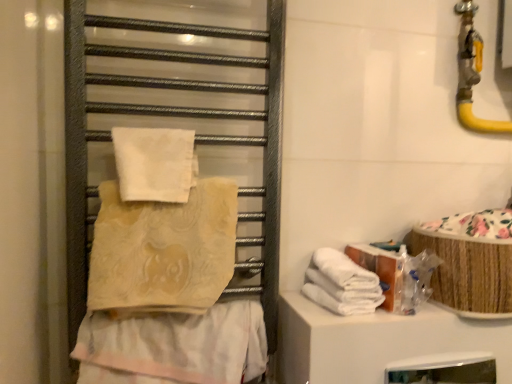
Where is `white soft towels at lower right, marked as the second towel in a bottom-to-top arrangement`? The height and width of the screenshot is (384, 512). white soft towels at lower right, marked as the second towel in a bottom-to-top arrangement is located at coordinates (341, 284).

The image size is (512, 384). What do you see at coordinates (178, 122) in the screenshot?
I see `metallic towel rack at left` at bounding box center [178, 122].

Identify the location of white soft towels at lower right, marked as the second towel in a bottom-to-top arrangement. The image size is (512, 384). (341, 284).

What's the angular difference between white soft towels at lower right, marked as the second towel in a bottom-to-top arrangement, and woven bamboo basket at right's facing directions?

They differ by 1.29 degrees in their facing directions.

Is woven bamboo basket at right surrounded by white soft towels at lower right, marked as the second towel in a bottom-to-top arrangement?

No, white soft towels at lower right, marked as the second towel in a bottom-to-top arrangement, does not contain woven bamboo basket at right.

Is white soft towels at lower right, marked as the second towel in a bottom-to-top arrangement, far from woven bamboo basket at right?

white soft towels at lower right, marked as the second towel in a bottom-to-top arrangement, is actually quite close to woven bamboo basket at right.

In terms of height, does white soft towels at lower right, marked as the second towel in a bottom-to-top arrangement, look taller or shorter compared to woven bamboo basket at right?

Considering their sizes, white soft towels at lower right, marked as the second towel in a bottom-to-top arrangement, has less height than woven bamboo basket at right.

Is beige textured towel at center, positioned as the second towel in top-to-bottom order, spatially inside beige textured towel at center, the fourth towel positioned from the top, or outside of it?

beige textured towel at center, positioned as the second towel in top-to-bottom order, exists outside the volume of beige textured towel at center, the fourth towel positioned from the top.

Considering the sizes of objects beige textured towel at center, positioned as the second towel in top-to-bottom order, and beige textured towel at center, the fourth towel positioned from the top, in the image provided, who is taller, beige textured towel at center, positioned as the second towel in top-to-bottom order, or beige textured towel at center, the fourth towel positioned from the top,?

beige textured towel at center, positioned as the second towel in top-to-bottom order.

Can you confirm if beige textured towel at center, positioned as the second towel in top-to-bottom order, is bigger than beige textured towel at center, the fourth towel positioned from the top?

Yes, beige textured towel at center, positioned as the second towel in top-to-bottom order, is bigger than beige textured towel at center, the fourth towel positioned from the top.

You are a GUI agent. You are given a task and a screenshot of the screen. Output one action in this format:
    pyautogui.click(x=<x>, y=<y>)
    Task: Click on the 1st towel behind the beige textured towel at center, positioned as the second towel in top-to-bottom order, counting from the anchor's position
    
    Given the screenshot: What is the action you would take?
    pyautogui.click(x=175, y=347)

Is metallic towel rack at left directly adjacent to beige textured towel at center, the fourth towel positioned from the top?

No, metallic towel rack at left is not beside beige textured towel at center, the fourth towel positioned from the top.

Do you think metallic towel rack at left is within beige textured towel at center, arranged as the 1th towel when ordered from the bottom, or outside of it?

The correct answer is: outside.

Is metallic towel rack at left closer to the viewer compared to beige textured towel at center, the fourth towel positioned from the top?

Yes, the depth of metallic towel rack at left is less than that of beige textured towel at center, the fourth towel positioned from the top.

From the image's perspective, is beige textured towel at center, the fourth towel positioned from the top, beneath white soft towels at lower right, acting as the third towel starting from the top?

Correct, beige textured towel at center, the fourth towel positioned from the top, appears lower than white soft towels at lower right, acting as the third towel starting from the top, in the image.

Which object is more forward, beige textured towel at center, the fourth towel positioned from the top, or white soft towels at lower right, marked as the second towel in a bottom-to-top arrangement?

beige textured towel at center, the fourth towel positioned from the top, is closer to the camera.

Based on the photo, is beige textured towel at center, the fourth towel positioned from the top, thinner than white soft towels at lower right, acting as the third towel starting from the top?

Yes.

Is beige textured towel at center, the fourth towel positioned from the top, directly adjacent to white soft towels at lower right, marked as the second towel in a bottom-to-top arrangement?

No, beige textured towel at center, the fourth towel positioned from the top, is not making contact with white soft towels at lower right, marked as the second towel in a bottom-to-top arrangement.

In order to click on towel in front of the beige textured towel at center, arranged as the 1th towel when ordered from the bottom in this screenshot , I will do `click(163, 251)`.

Based on the photo, is beige textured towel at center, arranged as the 1th towel when ordered from the bottom, not inside beige textured towel at center, the third towel when ordered from bottom to top?

beige textured towel at center, arranged as the 1th towel when ordered from the bottom, is positioned outside beige textured towel at center, the third towel when ordered from bottom to top.

Considering the sizes of beige textured towel at center, arranged as the 1th towel when ordered from the bottom, and beige textured towel at center, positioned as the second towel in top-to-bottom order, in the image, is beige textured towel at center, arranged as the 1th towel when ordered from the bottom, bigger or smaller than beige textured towel at center, positioned as the second towel in top-to-bottom order,?

In the image, beige textured towel at center, arranged as the 1th towel when ordered from the bottom, appears to be smaller than beige textured towel at center, positioned as the second towel in top-to-bottom order.

Would you consider beige textured towel at center, the fourth towel positioned from the top, to be distant from beige textured towel at center, positioned as the second towel in top-to-bottom order?

beige textured towel at center, the fourth towel positioned from the top, is actually quite close to beige textured towel at center, positioned as the second towel in top-to-bottom order.

Does beige textured towel at center, the fourth towel positioned from the top, contain woven bamboo basket at right?

No, beige textured towel at center, the fourth towel positioned from the top, does not contain woven bamboo basket at right.

Find the location of a particular element. The image size is (512, 384). material that is above the beige textured towel at center, arranged as the 1th towel when ordered from the bottom (from the image's perspective) is located at coordinates (469, 259).

Which point is more distant from viewer, (x=232, y=361) or (x=437, y=276)?

The point (x=437, y=276) is farther.

From the picture: Considering the sizes of white soft towels at lower right, acting as the third towel starting from the top, and beige textured towel at center, arranged as the 1th towel when ordered from the bottom, in the image, is white soft towels at lower right, acting as the third towel starting from the top, wider or thinner than beige textured towel at center, arranged as the 1th towel when ordered from the bottom,?

Clearly, white soft towels at lower right, acting as the third towel starting from the top, has more width compared to beige textured towel at center, arranged as the 1th towel when ordered from the bottom.

Considering the sizes of objects white soft towels at lower right, marked as the second towel in a bottom-to-top arrangement, and beige textured towel at center, the fourth towel positioned from the top, in the image provided, who is shorter, white soft towels at lower right, marked as the second towel in a bottom-to-top arrangement, or beige textured towel at center, the fourth towel positioned from the top,?

white soft towels at lower right, marked as the second towel in a bottom-to-top arrangement.

Is white soft towels at lower right, marked as the second towel in a bottom-to-top arrangement, far away from beige textured towel at center, arranged as the 1th towel when ordered from the bottom?

No.

Is beige textured towel at center, arranged as the 1th towel when ordered from the bottom, located within white soft towels at lower right, acting as the third towel starting from the top?

Actually, beige textured towel at center, arranged as the 1th towel when ordered from the bottom, is outside white soft towels at lower right, acting as the third towel starting from the top.

What are the coordinates of `material behind the white soft towels at lower right, marked as the second towel in a bottom-to-top arrangement` in the screenshot? It's located at (469, 259).

This screenshot has width=512, height=384. What are the coordinates of `the 1st towel to the right when counting from the beige textured towel at center, positioned as the second towel in top-to-bottom order` in the screenshot? It's located at (175, 347).

Estimate the real-world distances between objects in this image. Which object is further from white soft towels at lower right, marked as the second towel in a bottom-to-top arrangement, beige textured towel at center, the fourth towel positioned from the top, or woven bamboo basket at right?

beige textured towel at center, the fourth towel positioned from the top, lies further to white soft towels at lower right, marked as the second towel in a bottom-to-top arrangement, than the other object.

Which object lies nearer to the anchor point white soft towels at lower right, acting as the third towel starting from the top, woven bamboo basket at right or white soft towel at upper center, which is the first towel in top-to-bottom order?

woven bamboo basket at right.

Based on their spatial positions, is white soft towels at lower right, acting as the third towel starting from the top, or beige textured towel at center, arranged as the 1th towel when ordered from the bottom, closer to woven bamboo basket at right?

white soft towels at lower right, acting as the third towel starting from the top, is closer to woven bamboo basket at right.

Which object lies further to the anchor point white soft towels at lower right, acting as the third towel starting from the top, beige textured towel at center, the third towel when ordered from bottom to top, or white soft towel at upper center, marked as the 4th towel in a bottom-to-top arrangement?

white soft towel at upper center, marked as the 4th towel in a bottom-to-top arrangement.

Which object lies nearer to the anchor point white soft towel at upper center, marked as the 4th towel in a bottom-to-top arrangement, metallic towel rack at left or woven bamboo basket at right?

metallic towel rack at left is closer to white soft towel at upper center, marked as the 4th towel in a bottom-to-top arrangement.

Considering their positions, is beige textured towel at center, the fourth towel positioned from the top, positioned closer to woven bamboo basket at right than beige textured towel at center, positioned as the second towel in top-to-bottom order?

beige textured towel at center, the fourth towel positioned from the top, lies closer to woven bamboo basket at right than the other object.

From the image, which object appears to be nearer to white soft towels at lower right, marked as the second towel in a bottom-to-top arrangement, metallic towel rack at left or beige textured towel at center, the third towel when ordered from bottom to top?

Among the two, beige textured towel at center, the third towel when ordered from bottom to top, is located nearer to white soft towels at lower right, marked as the second towel in a bottom-to-top arrangement.

From the image, which object appears to be nearer to beige textured towel at center, arranged as the 1th towel when ordered from the bottom, white soft towels at lower right, marked as the second towel in a bottom-to-top arrangement, or white soft towel at upper center, which is the first towel in top-to-bottom order?

Result: white soft towels at lower right, marked as the second towel in a bottom-to-top arrangement, is closer to beige textured towel at center, arranged as the 1th towel when ordered from the bottom.

Where is `cage between white soft towel at upper center, which is the first towel in top-to-bottom order, and beige textured towel at center, positioned as the second towel in top-to-bottom order, vertically`? cage between white soft towel at upper center, which is the first towel in top-to-bottom order, and beige textured towel at center, positioned as the second towel in top-to-bottom order, vertically is located at coordinates (178, 122).

Find the location of a particular element. cage situated between beige textured towel at center, the third towel when ordered from bottom to top, and woven bamboo basket at right from left to right is located at coordinates (178, 122).

This screenshot has width=512, height=384. In order to click on cage between white soft towel at upper center, marked as the 4th towel in a bottom-to-top arrangement, and beige textured towel at center, arranged as the 1th towel when ordered from the bottom, from top to bottom in this screenshot , I will do `click(178, 122)`.

This screenshot has height=384, width=512. In order to click on cage situated between beige textured towel at center, arranged as the 1th towel when ordered from the bottom, and woven bamboo basket at right from left to right in this screenshot , I will do click(178, 122).